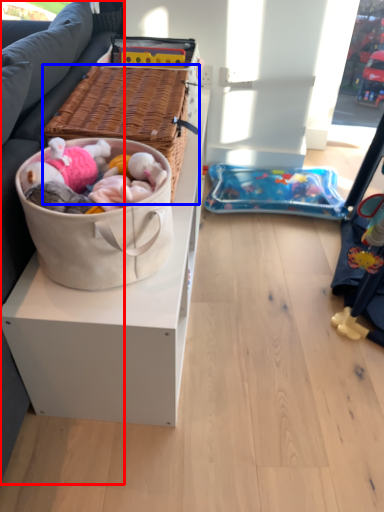
Question: Among these objects, which one is nearest to the camera, studio couch (highlighted by a red box) or picnic basket (highlighted by a blue box)?

Choices:
 (A) studio couch
 (B) picnic basket

Answer: (A)